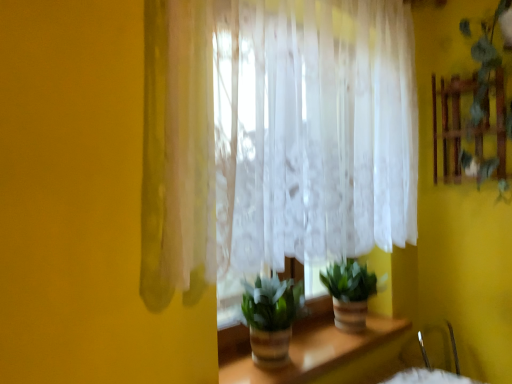
Question: From a real-world perspective, is green matte plant at center, placed as the 1th houseplant when sorted from back to front, below green leafy plant at upper right?

Choices:
 (A) yes
 (B) no

Answer: (A)

Question: Is green matte plant at center, which is counted as the second houseplant, starting from the left, smaller than green leafy plant at upper right?

Choices:
 (A) no
 (B) yes

Answer: (B)

Question: Considering the relative positions of green matte plant at center, placed as the 1th houseplant when sorted from back to front, and green leafy plant at upper right in the image provided, is green matte plant at center, placed as the 1th houseplant when sorted from back to front, in front of green leafy plant at upper right?

Choices:
 (A) no
 (B) yes

Answer: (A)

Question: Does green matte plant at center, the first houseplant positioned from the right, come behind green leafy plant at upper right?

Choices:
 (A) yes
 (B) no

Answer: (A)

Question: Is green matte plant at center, placed as the 2th houseplant when sorted from front to back, wider than green leafy plant at upper right?

Choices:
 (A) yes
 (B) no

Answer: (A)

Question: Is green matte plant at center, the first houseplant positioned from the right, wider or thinner than translucent white curtain at center?

Choices:
 (A) wide
 (B) thin

Answer: (A)

Question: Is point (352, 316) closer or farther from the camera than point (206, 158)?

Choices:
 (A) closer
 (B) farther

Answer: (B)

Question: From a real-world perspective, is green matte plant at center, the first houseplant positioned from the right, positioned above or below translucent white curtain at center?

Choices:
 (A) above
 (B) below

Answer: (B)

Question: From the image's perspective, is green matte plant at center, placed as the 1th houseplant when sorted from back to front, above or below translucent white curtain at center?

Choices:
 (A) above
 (B) below

Answer: (B)

Question: In the image, is green leafy plant at upper right positioned in front of or behind green matte plant at center, the first houseplant positioned from the right?

Choices:
 (A) front
 (B) behind

Answer: (A)

Question: Visually, is green leafy plant at upper right positioned to the left or to the right of green matte plant at center, which is counted as the second houseplant, starting from the left?

Choices:
 (A) left
 (B) right

Answer: (B)

Question: From a real-world perspective, is green leafy plant at upper right above or below green matte plant at center, placed as the 1th houseplant when sorted from back to front?

Choices:
 (A) below
 (B) above

Answer: (B)

Question: In terms of width, does green leafy plant at upper right look wider or thinner when compared to green matte plant at center, placed as the 2th houseplant when sorted from front to back?

Choices:
 (A) thin
 (B) wide

Answer: (A)

Question: In the image, is green matte plant at center, the first houseplant positioned from the right, positioned in front of or behind green matte plant at center, the first houseplant positioned from the front?

Choices:
 (A) front
 (B) behind

Answer: (B)

Question: In terms of size, does green matte plant at center, which is counted as the second houseplant, starting from the left, appear bigger or smaller than green matte plant at center, which ranks as the 2th houseplant in back-to-front order?

Choices:
 (A) small
 (B) big

Answer: (B)